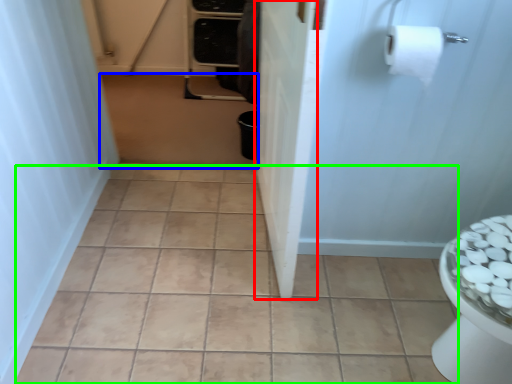
Question: Which is farther away from screen door (highlighted by a red box)? plain (highlighted by a blue box) or ceramic tile (highlighted by a green box)?

Choices:
 (A) plain
 (B) ceramic tile

Answer: (A)